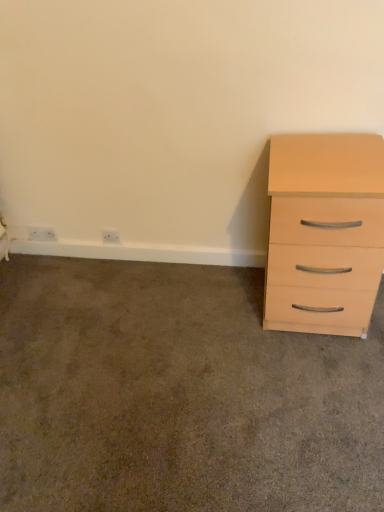
Find the location of a particular element. The height and width of the screenshot is (512, 384). vacant area in front of light wood/finish chest of drawers at right is located at coordinates (313, 379).